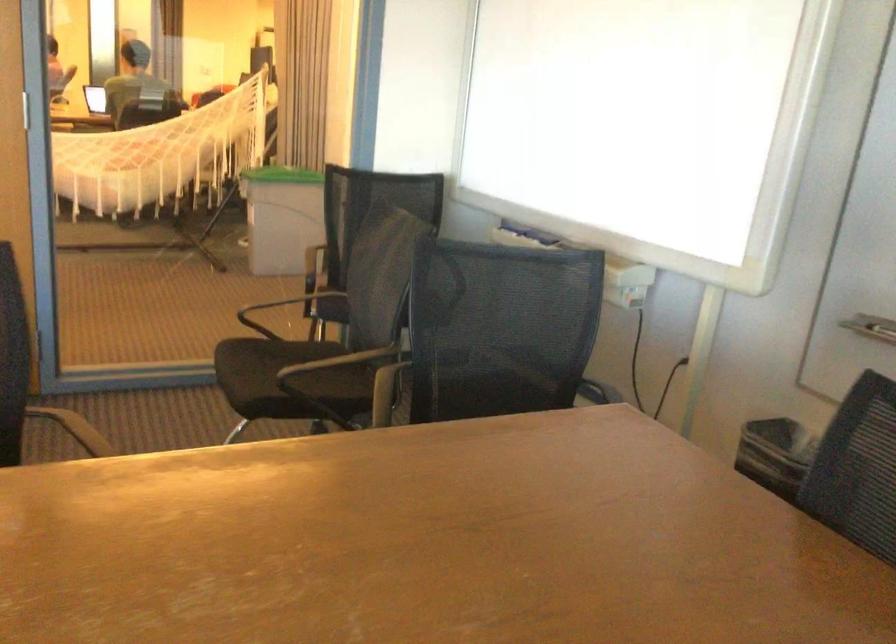
Where would you lift the green trash can lid? Please return your answer as a coordinate pair (x, y).

(282, 175)